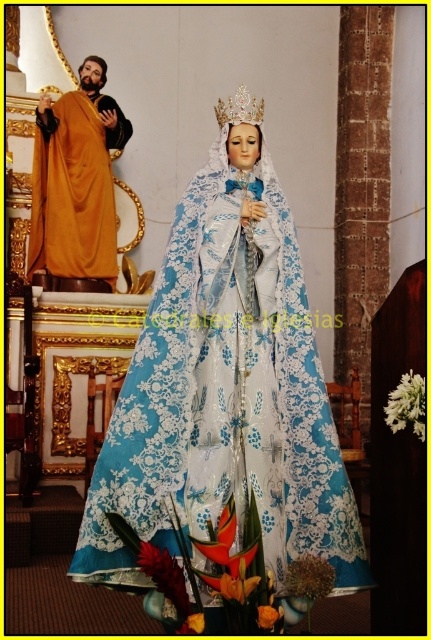
Question: Can you confirm if lace fabric statue at center is positioned below pearl-like crown at center?

Choices:
 (A) yes
 (B) no

Answer: (A)

Question: Which of the following is the farthest from the observer?

Choices:
 (A) (230, 104)
 (B) (90, 104)

Answer: (B)

Question: Which object is farther from the camera taking this photo?

Choices:
 (A) golden draped robe at left
 (B) lace fabric statue at center

Answer: (A)

Question: Is lace fabric statue at center to the left of golden draped robe at left from the viewer's perspective?

Choices:
 (A) yes
 (B) no

Answer: (B)

Question: Can you confirm if lace fabric statue at center is positioned to the left of pearl-like crown at center?

Choices:
 (A) no
 (B) yes

Answer: (A)

Question: Which object appears closest to the camera in this image?

Choices:
 (A) lace fabric statue at center
 (B) pearl-like crown at center

Answer: (A)